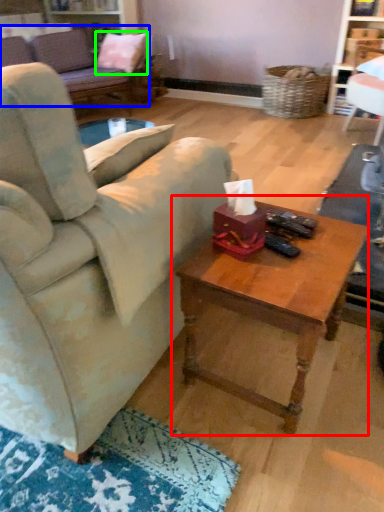
Question: Considering the real-world distances, which object is closest to coffee table (highlighted by a red box)? studio couch (highlighted by a blue box) or pillow (highlighted by a green box).

Choices:
 (A) studio couch
 (B) pillow

Answer: (A)